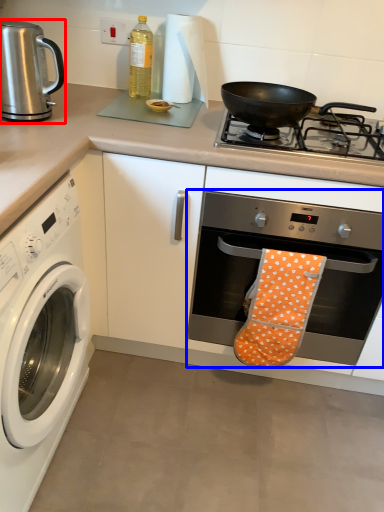
Question: Which point is closer to the camera, coffeepot (highlighted by a red box) or oven (highlighted by a blue box)?

Choices:
 (A) coffeepot
 (B) oven

Answer: (A)